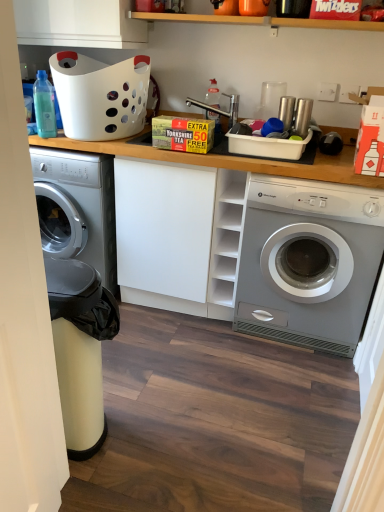
Question: From a real-world perspective, is white matte cabinet at center above or below translucent plastic bottle at upper left, marked as the 1th bottle in a front-to-back arrangement?

Choices:
 (A) above
 (B) below

Answer: (B)

Question: From the image's perspective, is white matte cabinet at center located above or below translucent plastic bottle at upper left, which is counted as the 2th bottle, starting from the back?

Choices:
 (A) below
 (B) above

Answer: (A)

Question: Estimate the real-world distances between objects in this image. Which object is closer to the translucent plastic bottle at center, acting as the 2th bottle starting from the left?

Choices:
 (A) white plastic basket at upper left
 (B) translucent plastic bottle at upper left, marked as the 1th bottle in a front-to-back arrangement
 (C) metallic faucet at center
 (D) white matte cabinet at center
 (E) satin silver washing machine at right

Answer: (C)

Question: Considering the real-world distances, which object is farthest from the metallic faucet at center?

Choices:
 (A) white plastic basket at upper left
 (B) white matte cabinet at center
 (C) translucent plastic bottle at upper left, positioned as the first bottle in left-to-right order
 (D) translucent plastic bottle at center, acting as the second bottle starting from the front
 (E) satin silver washing machine at right

Answer: (E)